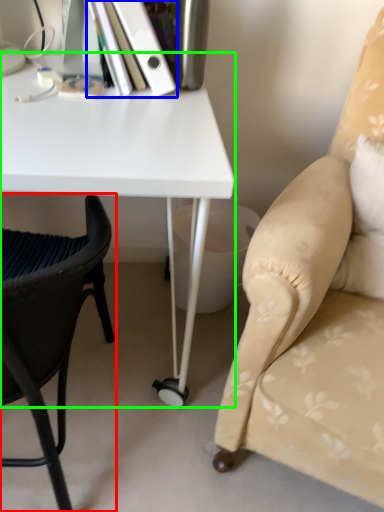
Question: Estimate the real-world distances between objects in this image. Which object is farther from chair (highlighted by a red box), paperback book (highlighted by a blue box) or desk (highlighted by a green box)?

Choices:
 (A) paperback book
 (B) desk

Answer: (A)